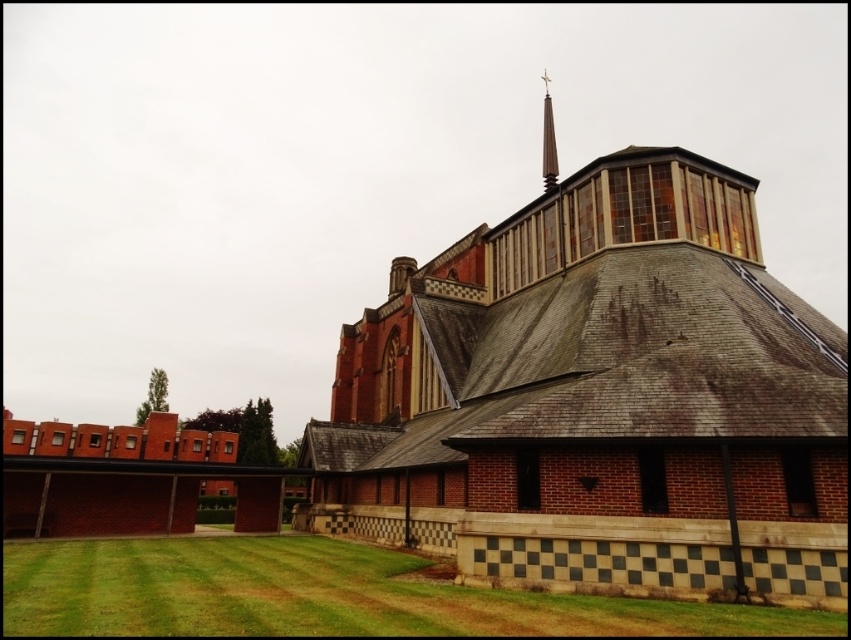
Between green grass at lower left and smooth gray spire at upper center, which one appears on the right side from the viewer's perspective?

From the viewer's perspective, smooth gray spire at upper center appears more on the right side.

Who is lower down, green grass at lower left or smooth gray spire at upper center?

A: green grass at lower left is below.

At what (x,y) coordinates should I click in order to perform the action: click on green grass at lower left. Please return your answer as a coordinate pair (x, y). The image size is (851, 640). Looking at the image, I should click on (323, 595).

Identify the location of green grass at lower left. This screenshot has width=851, height=640. (323, 595).

Does brick church at center have a greater width compared to smooth gray spire at upper center?

Incorrect, brick church at center's width does not surpass smooth gray spire at upper center's.

Does brick church at center come behind smooth gray spire at upper center?

That is False.

At what (x,y) coordinates should I click in order to perform the action: click on brick church at center. Please return your answer as a coordinate pair (x, y). Image resolution: width=851 pixels, height=640 pixels. Looking at the image, I should click on (598, 397).

Is brick church at center in front of green grass at lower left?

No, it is behind green grass at lower left.

Is brick church at center positioned at the back of green grass at lower left?

Yes, it is.

Is point (443, 433) positioned before point (347, 580)?

No, (443, 433) is behind (347, 580).

Locate an element on the screen. The image size is (851, 640). brick church at center is located at coordinates (598, 397).